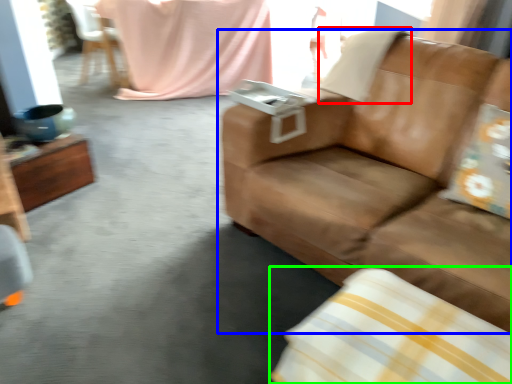
Question: Which is nearer to the pillow (highlighted by a red box)? studio couch (highlighted by a blue box) or pillow (highlighted by a green box).

Choices:
 (A) studio couch
 (B) pillow

Answer: (A)